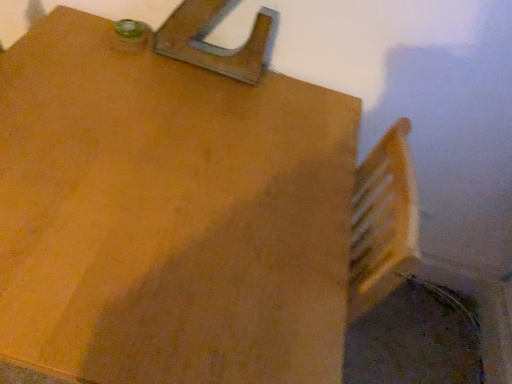
Locate an element on the screen. Image resolution: width=512 pixels, height=384 pixels. vacant area on top of matte wood table at upper left (from a real-world perspective) is located at coordinates (136, 191).